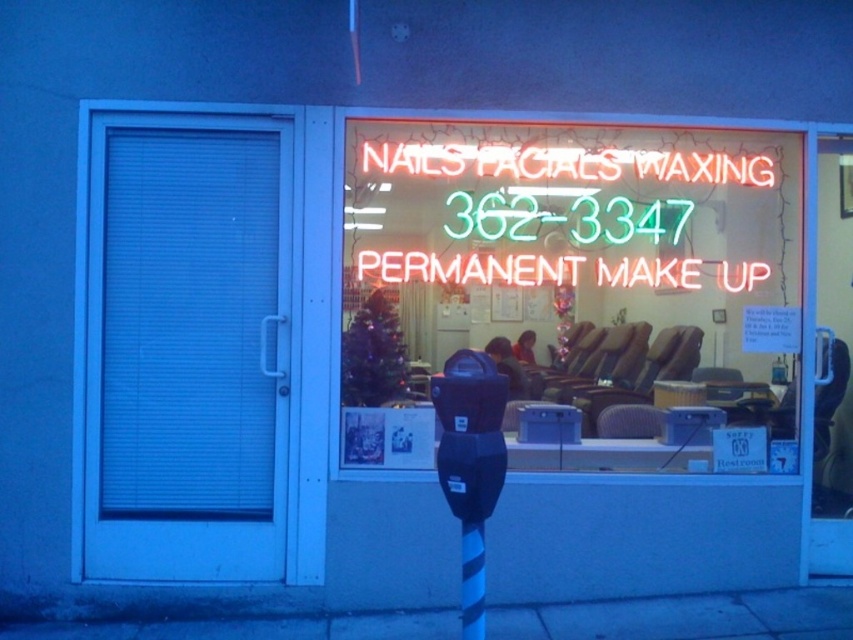
Is point (460, 237) more distant than point (466, 600)?

Yes, point (460, 237) is farther from viewer.

Is neon sign at upper center below black striped pole at center?

Incorrect, neon sign at upper center is not positioned below black striped pole at center.

Describe the element at coordinates (578, 284) in the screenshot. I see `neon sign at upper center` at that location.

Where is `neon sign at upper center`? The height and width of the screenshot is (640, 853). neon sign at upper center is located at coordinates (578, 284).

Is the position of neon sign at upper center more distant than that of black plastic parking meter at lower center?

Yes, it is behind black plastic parking meter at lower center.

Between neon sign at upper center and black plastic parking meter at lower center, which one appears on the left side from the viewer's perspective?

black plastic parking meter at lower center is more to the left.

Measure the distance between point (567,225) and camera.

Point (567,225) and camera are 5.34 meters apart.

This screenshot has width=853, height=640. Identify the location of neon sign at upper center. (578, 284).

Can you confirm if neontexturedsign at center is thinner than black plastic parking meter at lower center?

No, neontexturedsign at center is not thinner than black plastic parking meter at lower center.

Is point (625, 225) closer to camera compared to point (440, 403)?

That is False.

Image resolution: width=853 pixels, height=640 pixels. I want to click on neontexturedsign at center, so click(x=566, y=189).